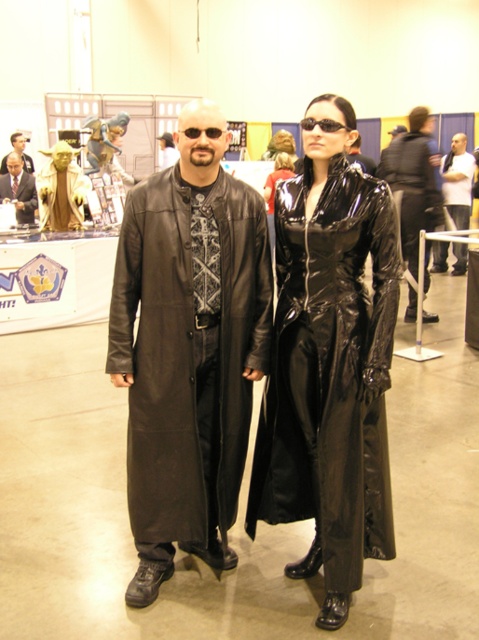
Can you confirm if black leather coat at center is bigger than shiny black trench coat at center?

Incorrect, black leather coat at center is not larger than shiny black trench coat at center.

Is point (180, 333) positioned behind point (410, 316)?

That is False.

Between point (230, 465) and point (417, 186), which one is positioned in front?

Point (230, 465) is more forward.

Locate an element on the screen. The image size is (479, 640). black leather coat at center is located at coordinates (189, 348).

Is point (358, 461) positioned after point (453, 154)?

No, (358, 461) is closer to viewer.

Does glossy black suit at center have a greater width compared to dark leather coat at center?

No, glossy black suit at center is not wider than dark leather coat at center.

This screenshot has width=479, height=640. Identify the location of glossy black suit at center. (330, 362).

This screenshot has height=640, width=479. What are the coordinates of `glossy black suit at center` in the screenshot? It's located at (330, 362).

Does dark leather coat at center have a greater height compared to matte black suit at center?

Yes.

Can you confirm if dark leather coat at center is positioned above matte black suit at center?

No, dark leather coat at center is not above matte black suit at center.

The height and width of the screenshot is (640, 479). Identify the location of dark leather coat at center. [457, 180].

The width and height of the screenshot is (479, 640). In order to click on dark leather coat at center in this screenshot , I will do `click(457, 180)`.